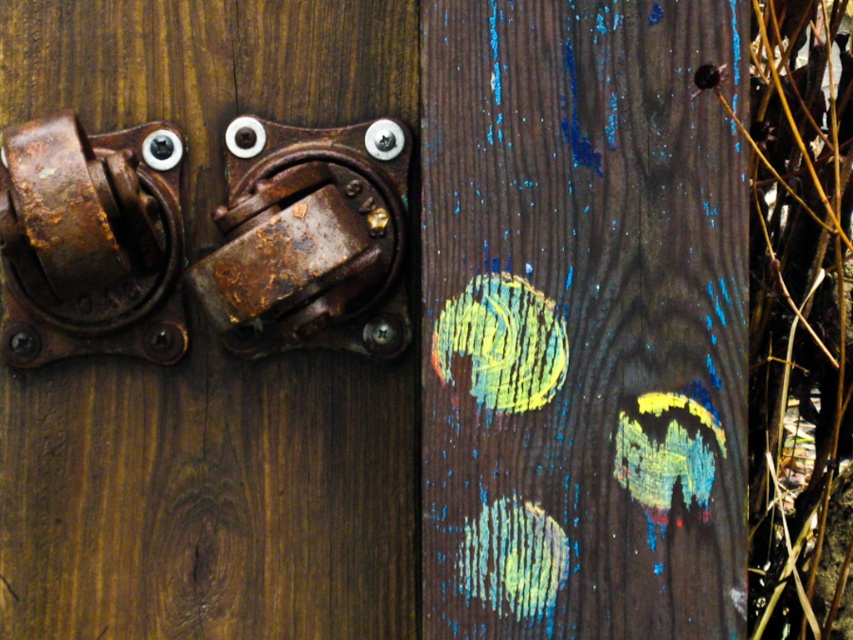
Question: Which object is positioned farthest from the rusty metal door handle at left?

Choices:
 (A) rusty metal door handle at center
 (B) wooden plank with paint splatters at center

Answer: (B)

Question: Considering the relative positions of wooden plank with paint splatters at center and rusty metal door handle at left in the image provided, where is wooden plank with paint splatters at center located with respect to rusty metal door handle at left?

Choices:
 (A) left
 (B) right

Answer: (B)

Question: Which object is positioned farthest from the rusty metal door handle at center?

Choices:
 (A) rusty metal door handle at left
 (B) wooden plank with paint splatters at center

Answer: (B)

Question: Is wooden plank with paint splatters at center to the right of rusty metal door handle at center from the viewer's perspective?

Choices:
 (A) no
 (B) yes

Answer: (B)

Question: Is wooden plank with paint splatters at center smaller than rusty metal door handle at left?

Choices:
 (A) no
 (B) yes

Answer: (B)

Question: Which of the following is the farthest from the observer?

Choices:
 (A) (16, 224)
 (B) (393, 124)

Answer: (B)